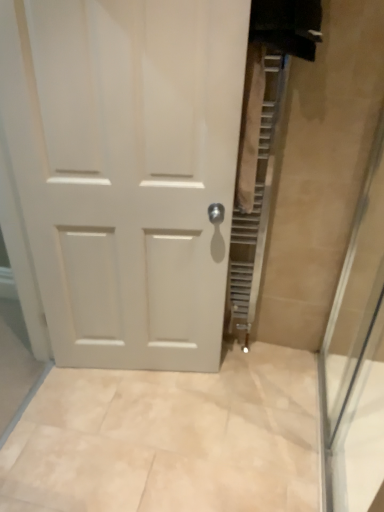
Image resolution: width=384 pixels, height=512 pixels. Find the location of `vacant space behind transparent glass shower door at right`. vacant space behind transparent glass shower door at right is located at coordinates (280, 387).